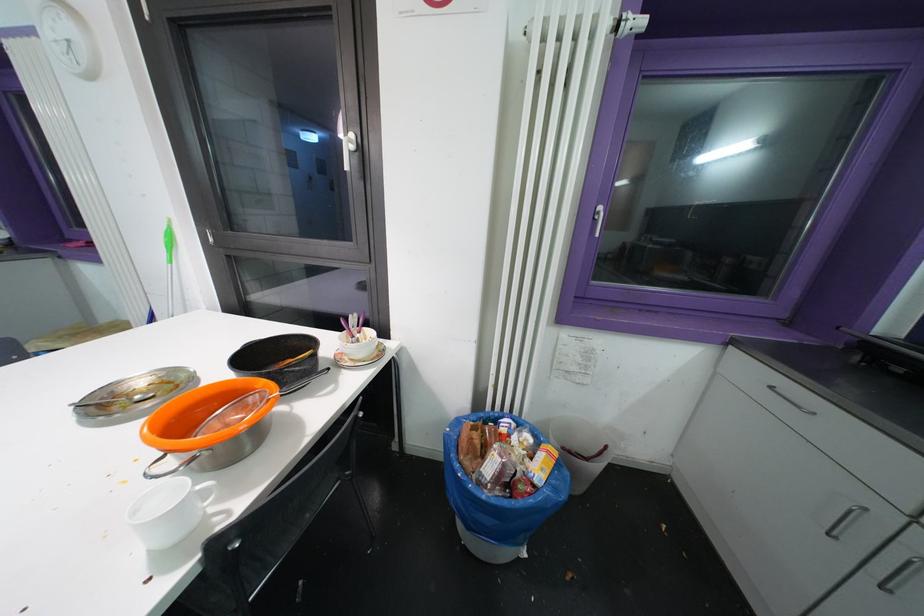
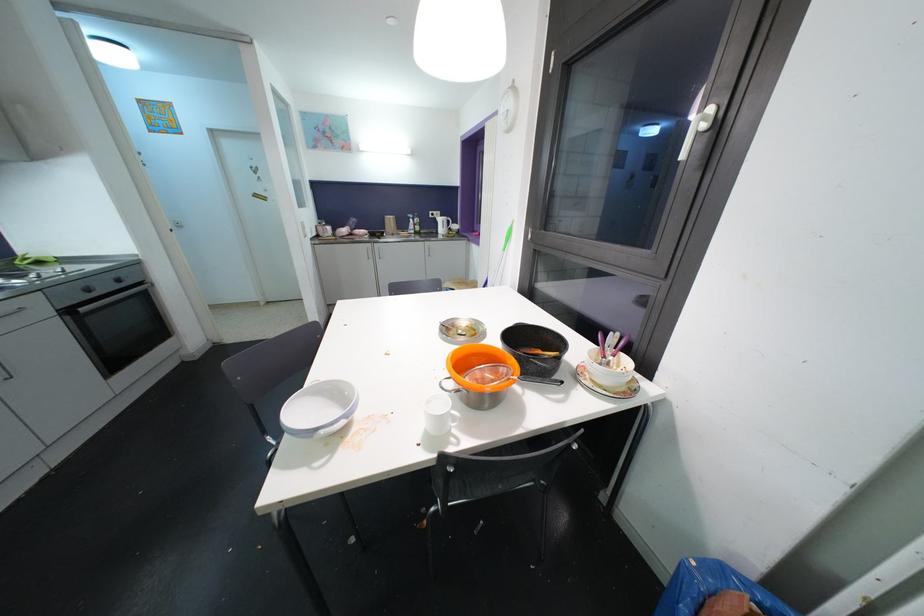
In the second image, find the point that corresponds to [198,487] in the first image.

(456, 411)